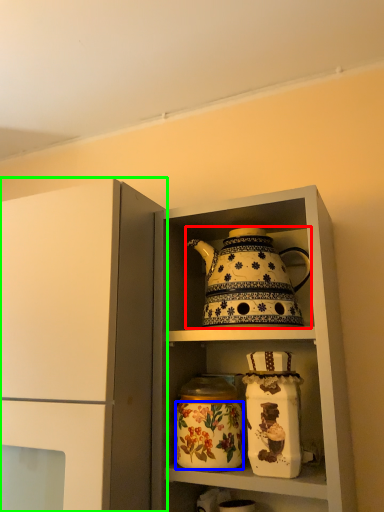
Question: Which object is positioned farthest from kettle (highlighted by a red box)? Select from flower (highlighted by a blue box) and cupboard (highlighted by a green box).

Choices:
 (A) flower
 (B) cupboard

Answer: (B)